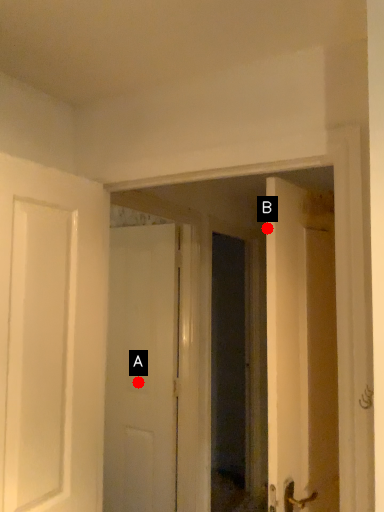
Question: Two points are circled on the image, labeled by A and B beside each circle. Which point is farther from the camera taking this photo?

Choices:
 (A) A is further
 (B) B is further

Answer: (A)